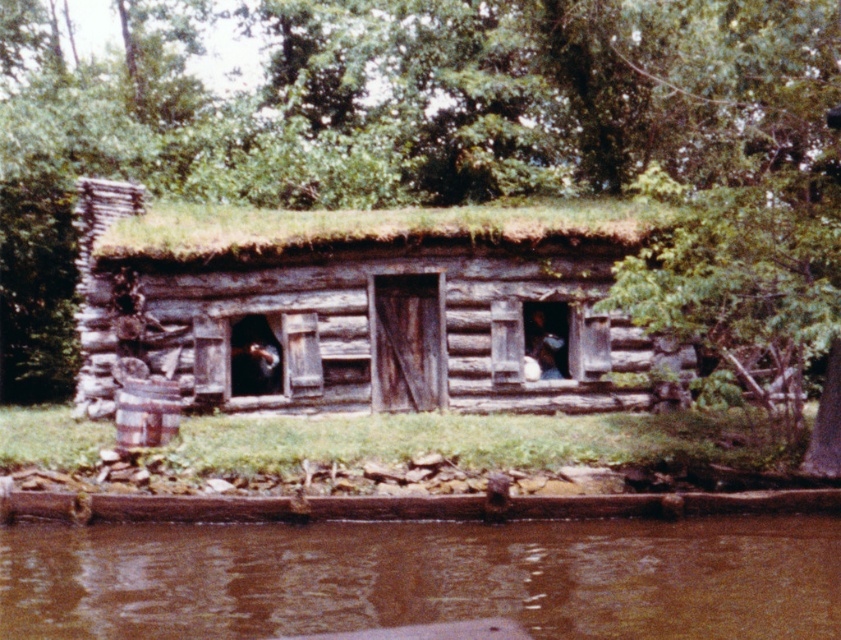
You are standing in front of the rustic log cabin and notice a green leafy tree at center and green grass at lower center. Which of these two objects is bigger in size?

The green leafy tree at center is larger in size than the green grass at lower center.

You are standing in front of the rustic log cabin and notice the green leafy tree at center and the green grass at lower center. Which object is positioned higher relative to the other?

The green leafy tree at center is located above green grass at lower center, so it is positioned higher than the grass.